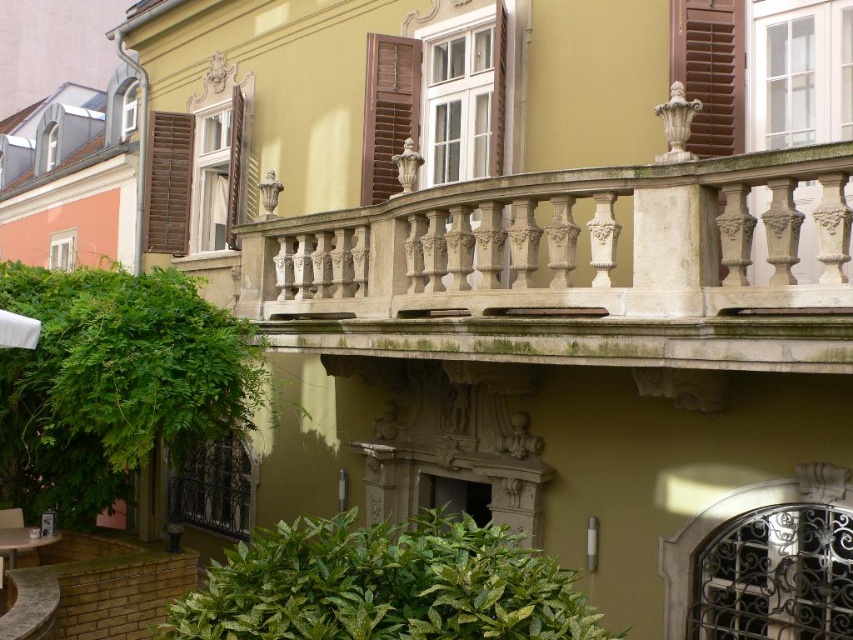
You are standing in front of the building and notice a specific point marked at coordinates point (x=236, y=164). Based on the scene description, what material is present at that location?

The point (x=236, y=164) marks wooden at upper left.

You are a painter standing at the base of the building and want to paint both the white stone railing at upper center and the white fabric umbrella at lower left. You have a ladder that can reach up to 10 feet. Can you reach both objects with your ladder?

The white stone railing at upper center and white fabric umbrella at lower left are 9.61 feet apart from each other. Since the ladder can reach up to 10 feet, you can reach both objects as the distance between them is within the ladder height limit.